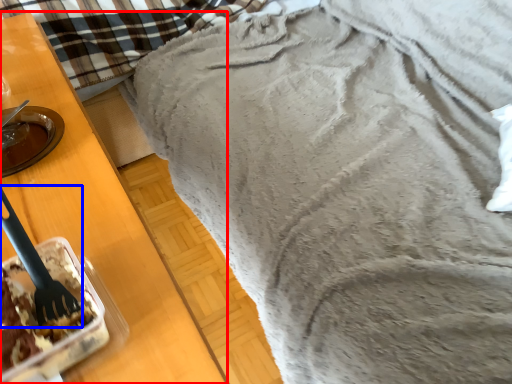
Question: Which point is further to the camera, furniture (highlighted by a red box) or silverware (highlighted by a blue box)?

Choices:
 (A) furniture
 (B) silverware

Answer: (B)